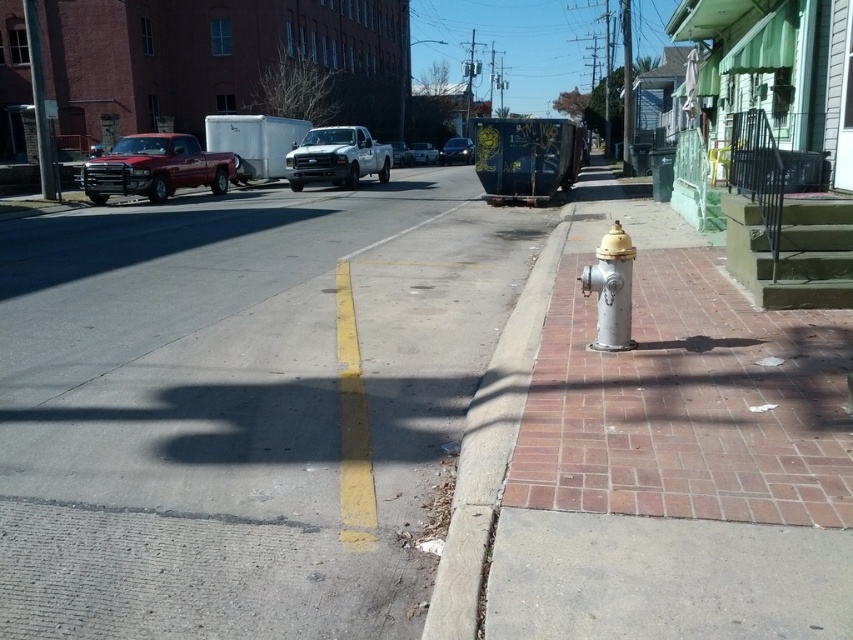
Question: Is gray asphalt at center to the left of metallic silver truck at center from the viewer's perspective?

Choices:
 (A) no
 (B) yes

Answer: (A)

Question: Which object appears closest to the camera in this image?

Choices:
 (A) shiny red truck at left
 (B) metallic silver truck at center
 (C) concrete at right

Answer: (C)

Question: Can you confirm if shiny red truck at left is positioned to the left of matte white truck at center?

Choices:
 (A) yes
 (B) no

Answer: (A)

Question: Which object is positioned farthest from the white matte truck at center?

Choices:
 (A) silver metallic fire hydrant at right
 (B) shiny black sedan at center

Answer: (B)

Question: Considering the real-world distances, which object is farthest from the silver metallic fire hydrant at right?

Choices:
 (A) shiny black sedan at center
 (B) concrete at right

Answer: (A)

Question: From the image, what is the correct spatial relationship of gray asphalt at center in relation to shiny red truck at left?

Choices:
 (A) right
 (B) left

Answer: (A)